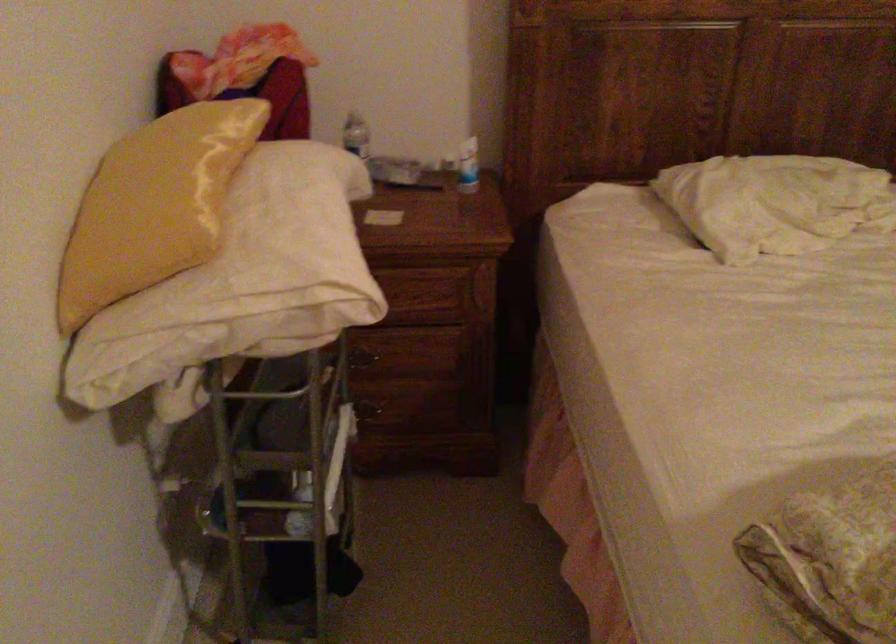
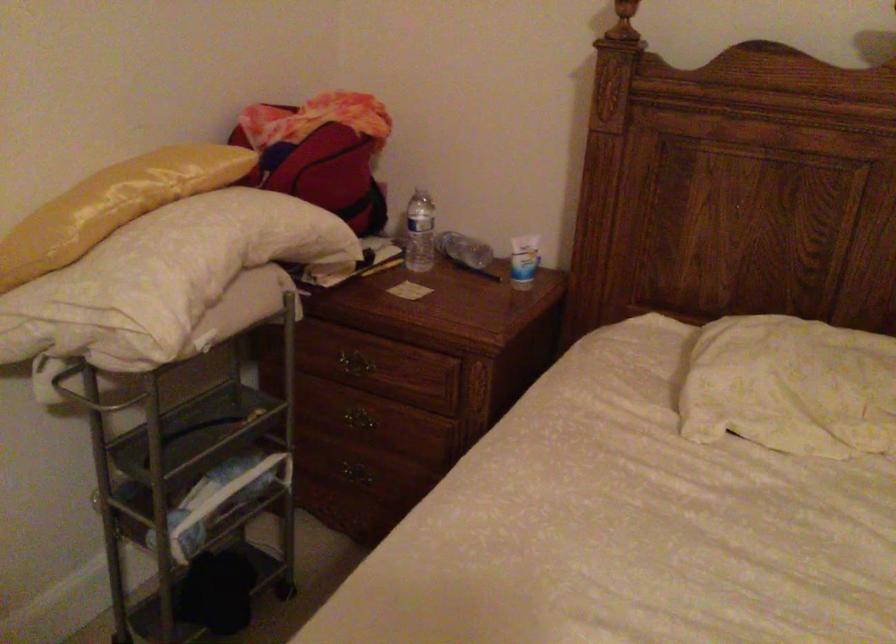
In the second image, find the point that corresponds to the point at 366,158 in the first image.

(419, 232)